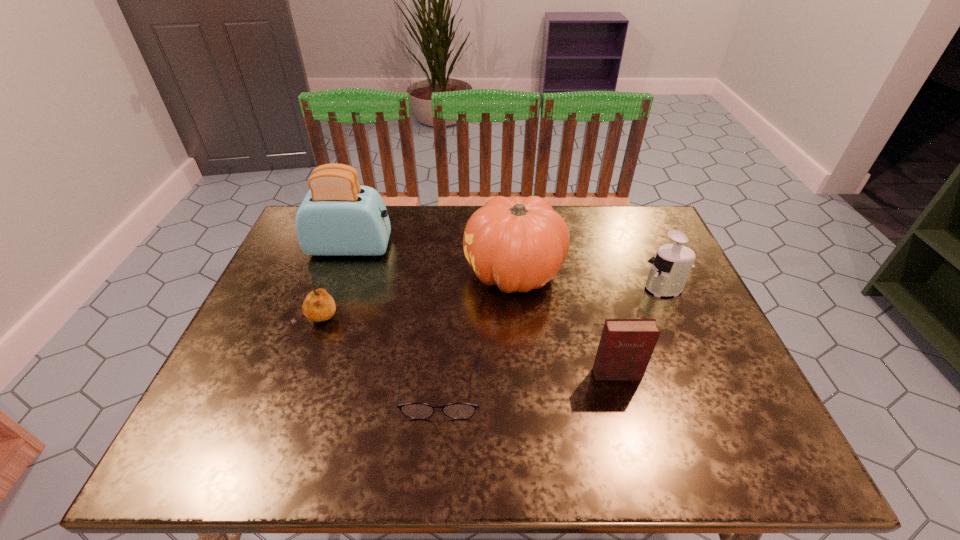
Locate an element on the screen. the tallest object is located at coordinates (338, 217).

Where is `the second tallest object`? the second tallest object is located at coordinates (518, 244).

Find the location of `juicer`. juicer is located at coordinates (670, 269).

The image size is (960, 540). I want to click on diary, so click(626, 345).

You are a GUI agent. You are given a task and a screenshot of the screen. Output one action in this format:
    pyautogui.click(x=<x>, y=<y>)
    Task: Click on the fifth tallest object
    The height and width of the screenshot is (540, 960).
    Given the screenshot: What is the action you would take?
    pyautogui.click(x=318, y=305)

The height and width of the screenshot is (540, 960). What are the coordinates of `spectacles` in the screenshot? It's located at pos(418,411).

You are a GUI agent. You are given a task and a screenshot of the screen. Output one action in this format:
    pyautogui.click(x=<x>, y=<y>)
    Task: Click on the free region located 0.400m on the side of the toaster with the lever
    
    Given the screenshot: What is the action you would take?
    pyautogui.click(x=529, y=247)

This screenshot has height=540, width=960. What are the coordinates of `blank space located 0.340m on the carved face of the pumpkin` in the screenshot? It's located at (341, 273).

The width and height of the screenshot is (960, 540). I want to click on free spot located 0.360m on the carved face of the pumpkin, so click(x=333, y=273).

The width and height of the screenshot is (960, 540). What are the coordinates of `free space located on the carved face of the pumpkin` in the screenshot? It's located at (380, 273).